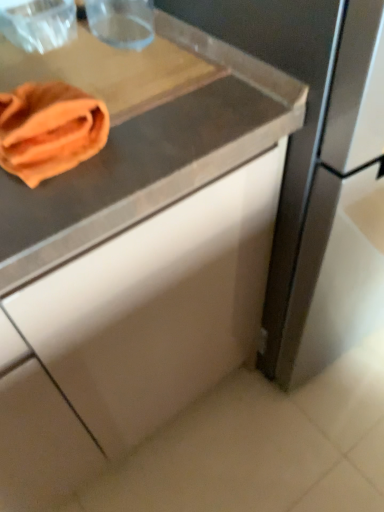
Question: Considering the positions of orange microfiber cloth at upper left and orange cloth at upper left in the image, is orange microfiber cloth at upper left wider or thinner than orange cloth at upper left?

Choices:
 (A) wide
 (B) thin

Answer: (B)

Question: From a real-world perspective, is orange microfiber cloth at upper left positioned above or below orange cloth at upper left?

Choices:
 (A) below
 (B) above

Answer: (B)

Question: From the image's perspective, is orange microfiber cloth at upper left above or below orange cloth at upper left?

Choices:
 (A) above
 (B) below

Answer: (B)

Question: From the image's perspective, is orange cloth at upper left located above or below orange microfiber cloth at upper left?

Choices:
 (A) above
 (B) below

Answer: (A)

Question: Which is correct: orange cloth at upper left is inside orange microfiber cloth at upper left, or outside of it?

Choices:
 (A) inside
 (B) outside

Answer: (B)

Question: Considering the positions of orange cloth at upper left and orange microfiber cloth at upper left in the image, is orange cloth at upper left wider or thinner than orange microfiber cloth at upper left?

Choices:
 (A) thin
 (B) wide

Answer: (B)

Question: Is point (127, 74) positioned closer to the camera than point (86, 135)?

Choices:
 (A) closer
 (B) farther

Answer: (B)